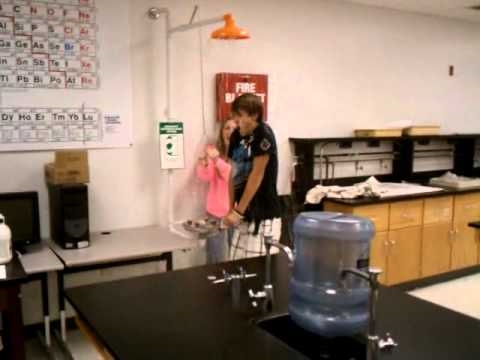
Where is `cabinet`? This screenshot has width=480, height=360. cabinet is located at coordinates (413, 226).